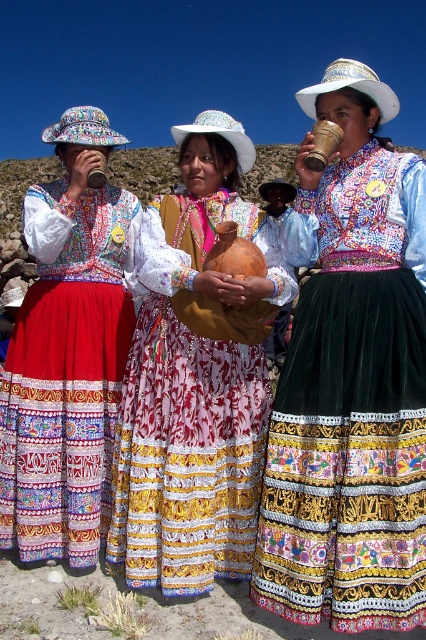
You are an anthropologist examining the artifacts in the image. You see a matte brown clay cup at center and a matte brown clay pot at center. Which object is closer to you?

The matte brown clay cup at center is closer to you because it is in front of the matte brown clay pot at center.

You are a photographer trying to capture the scene with the matte brown clay cup at center and the matte black cup at left. Which cup is positioned lower in the image?

The matte brown clay cup at center is positioned lower than the matte black cup at left.

You are a photographer planning to take a picture of the matte brown clay pot at center and the matte black cup at left. Based on their positions, which object should you focus on first if you want to capture both in the frame without moving the camera?

The matte black cup at left should be focused on first since it is positioned to the left of the matte brown clay pot at center, allowing the photographer to frame both items by starting with the leftmost object.